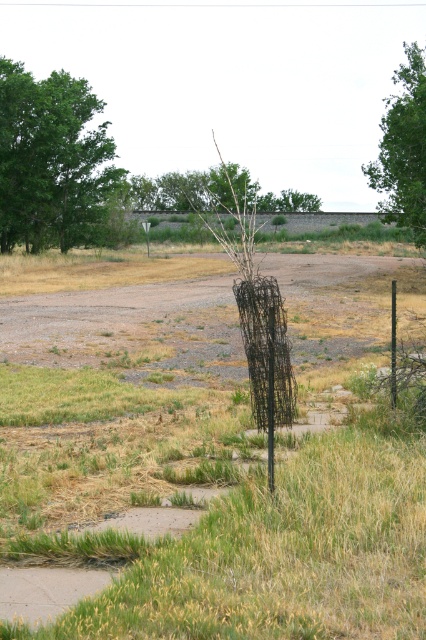
You are standing in the outdoor scene and want to take a photo of both the point at coordinates point (58,192) and point (420,97). Which point should you focus on first to ensure both are in focus?

You should focus on point (58,192) first because it is closer to the camera than point (420,97). By focusing on the closer point, the farther point will also be in focus due to the depth of field.

You are a landscape architect designing a new garden. You have to place a new statue exactly at the point marked by point (51,161). According to the image, what is the nearest object to this point?

The nearest object to point (51,161) is the green leafy tree at upper left, as the point indicates its location.